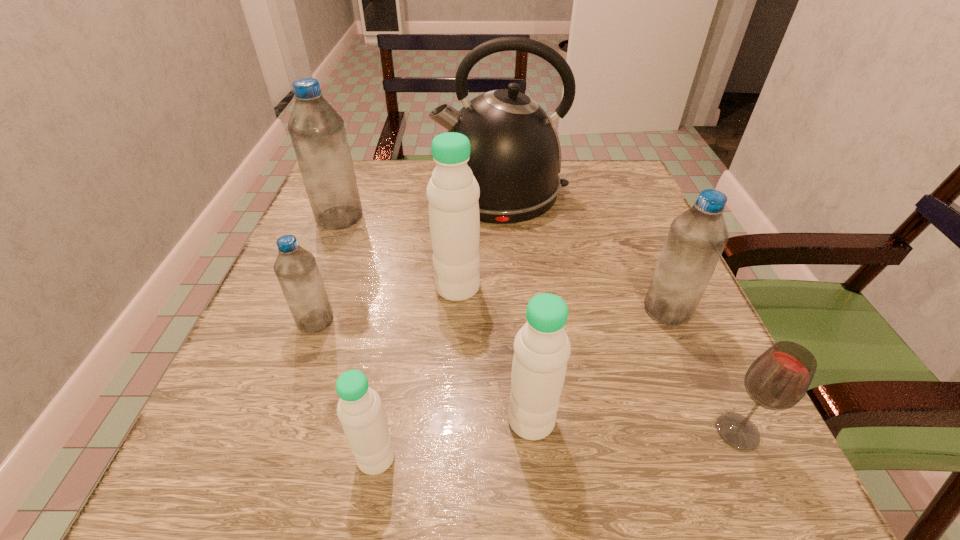
The height and width of the screenshot is (540, 960). Find the location of `empty location between the black kettle and the glass drink container`. empty location between the black kettle and the glass drink container is located at coordinates (619, 311).

You are a GUI agent. You are given a task and a screenshot of the screen. Output one action in this format:
    pyautogui.click(x=<x>, y=<y>)
    Task: Click on the vacant area between the rightmost blue water bottle and the smallest blue water bottle
    This screenshot has height=540, width=960.
    Given the screenshot: What is the action you would take?
    pyautogui.click(x=492, y=315)

Identify the location of unoccupied area between the glass drink container and the second water bottle from right to left. (635, 426).

At what (x,y) coordinates should I click in order to perform the action: click on object that is the seventh closest one to the smallest blue water bottle. Please return your answer as a coordinate pair (x, y). This screenshot has width=960, height=540. Looking at the image, I should click on (778, 379).

Locate which object ranks second in proximity to the biggest white water bottle. Please provide its 2D coordinates. Your answer should be formatted as a tuple, i.e. [(x, y)], where the tuple contains the x and y coordinates of a point satisfying the conditions above.

[(296, 269)]

Where is `water bottle identified as the third closest to the kettle`? water bottle identified as the third closest to the kettle is located at coordinates (696, 239).

In order to click on water bottle that stands as the closest to the rightmost white water bottle in this screenshot , I will do `click(359, 409)`.

Locate an element on the screen. This screenshot has width=960, height=540. the third closest blue water bottle to the glass drink container is located at coordinates pyautogui.click(x=317, y=131).

At what (x,y) coordinates should I click in order to perform the action: click on the closest blue water bottle relative to the second biggest blue water bottle. Please return your answer as a coordinate pair (x, y). The image size is (960, 540). Looking at the image, I should click on (296, 269).

You are a GUI agent. You are given a task and a screenshot of the screen. Output one action in this format:
    pyautogui.click(x=<x>, y=<y>)
    Task: Click on the white water bottle that is the second closest to the rightmost white water bottle
    The height and width of the screenshot is (540, 960).
    Given the screenshot: What is the action you would take?
    pyautogui.click(x=453, y=192)